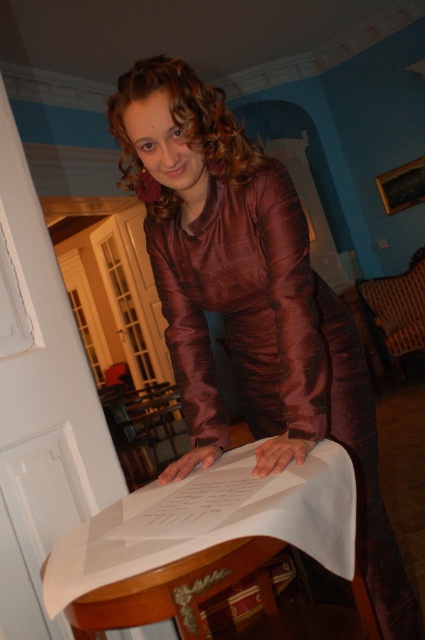
Which is above, white paper at center or brown fabric chair at lower right?

Positioned higher is brown fabric chair at lower right.

The image size is (425, 640). What do you see at coordinates (201, 541) in the screenshot?
I see `white paper at center` at bounding box center [201, 541].

Find the location of a particular element. white paper at center is located at coordinates (201, 541).

Is point (289, 384) closer to viewer compared to point (150, 586)?

No, (289, 384) is further to viewer.

Does matte purple dress at center have a greater height compared to white paper at center?

Correct, matte purple dress at center is much taller as white paper at center.

The width and height of the screenshot is (425, 640). What do you see at coordinates (249, 300) in the screenshot?
I see `matte purple dress at center` at bounding box center [249, 300].

Locate an element on the screen. This screenshot has height=640, width=425. matte purple dress at center is located at coordinates (249, 300).

Is matte purple dress at center positioned behind brown fabric chair at lower right?

No, it is not.

Is point (249, 234) less distant than point (408, 348)?

Yes, it is in front of point (408, 348).

Does point (283, 230) come farther from viewer compared to point (402, 340)?

That is False.

Locate an element on the screen. Image resolution: width=425 pixels, height=640 pixels. matte purple dress at center is located at coordinates (249, 300).